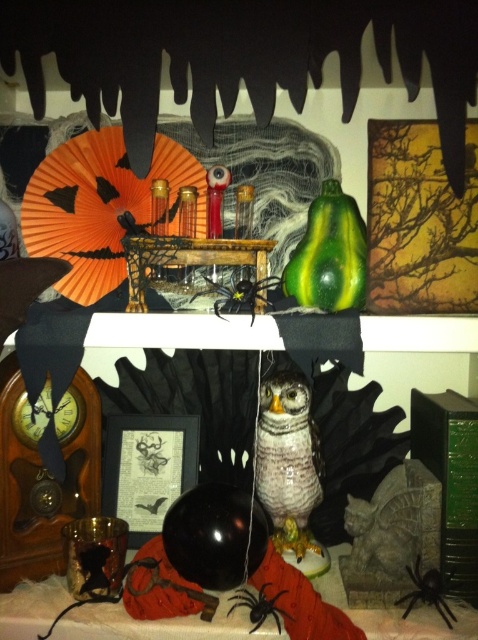
In the scene shown: Does black matte balloon at lower center appear on the left side of matte black frame at center?

Incorrect, black matte balloon at lower center is not on the left side of matte black frame at center.

Can you confirm if black matte balloon at lower center is wider than matte black frame at center?

Yes, black matte balloon at lower center is wider than matte black frame at center.

Is point (0, 608) closer to camera compared to point (144, 524)?

Yes, it is.

You are a GUI agent. You are given a task and a screenshot of the screen. Output one action in this format:
    pyautogui.click(x=<x>, y=<y>)
    Task: Click on the black matte balloon at lower center
    The height and width of the screenshot is (640, 478).
    Given the screenshot: What is the action you would take?
    pyautogui.click(x=160, y=625)

Who is higher up, black matte balloon at lower center or speckled ceramic owl at center?

speckled ceramic owl at center

Measure the distance between black matte balloon at lower center and speckled ceramic owl at center.

The distance of black matte balloon at lower center from speckled ceramic owl at center is 7.80 inches.

Locate an element on the screen. The width and height of the screenshot is (478, 640). black matte balloon at lower center is located at coordinates (160, 625).

Which is more to the right, speckled ceramic owl at center or black matte spider at lower center?

speckled ceramic owl at center is more to the right.

Can you confirm if speckled ceramic owl at center is positioned to the left of black matte spider at lower center?

Incorrect, speckled ceramic owl at center is not on the left side of black matte spider at lower center.

Image resolution: width=478 pixels, height=640 pixels. Describe the element at coordinates (289, 461) in the screenshot. I see `speckled ceramic owl at center` at that location.

I want to click on speckled ceramic owl at center, so click(289, 461).